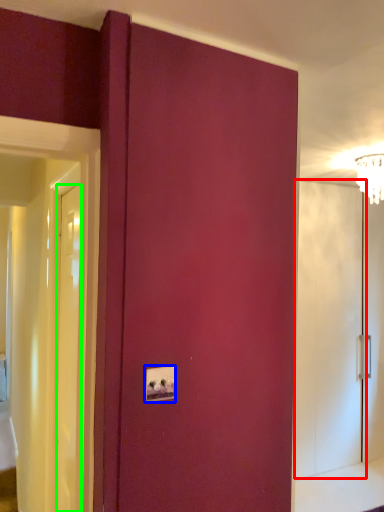
Question: Based on their relative distances, which object is farther from screen door (highlighted by a red box)? Choose from light switch (highlighted by a blue box) and door (highlighted by a green box).

Choices:
 (A) light switch
 (B) door

Answer: (A)